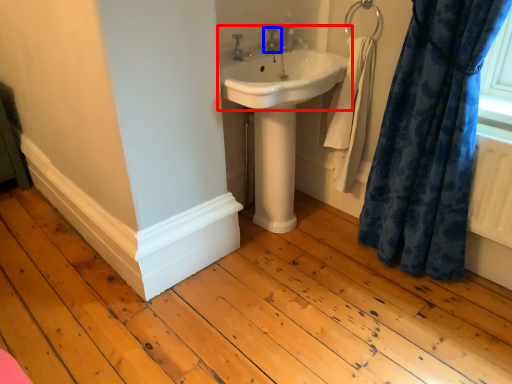
Question: Which of the following is the closest to the observer, sink (highlighted by a red box) or tap (highlighted by a blue box)?

Choices:
 (A) sink
 (B) tap

Answer: (A)